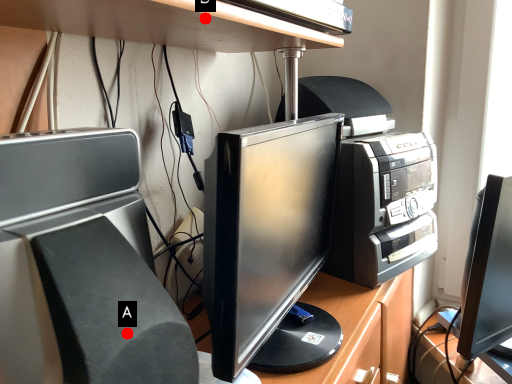
Question: Two points are circled on the image, labeled by A and B beside each circle. Which point is farther from the camera taking this photo?

Choices:
 (A) A is further
 (B) B is further

Answer: (B)